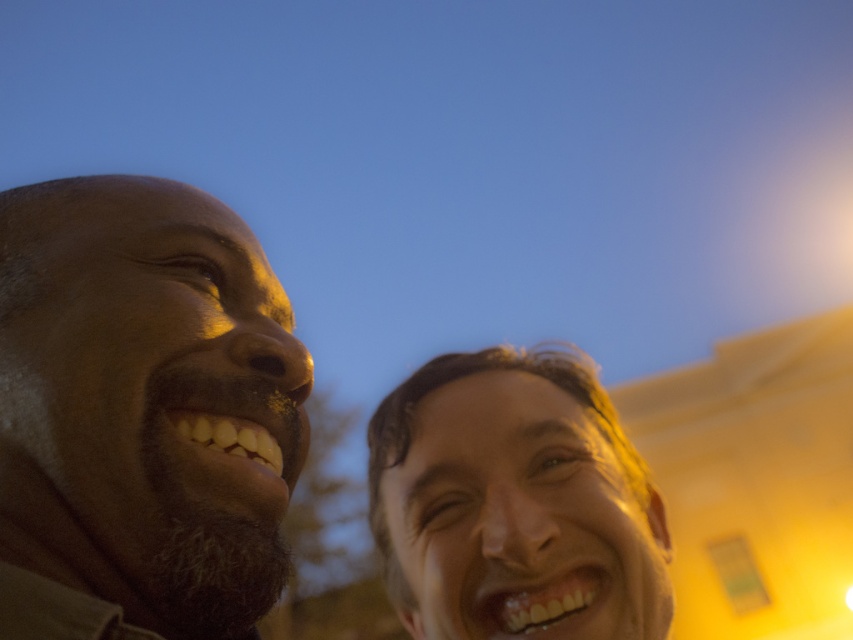
Question: Can you confirm if matte brown beard at left is positioned above shiny golden hair at center?

Choices:
 (A) no
 (B) yes

Answer: (B)

Question: Which of the following is the closest to the observer?

Choices:
 (A) click(x=1, y=540)
 (B) click(x=665, y=593)

Answer: (A)

Question: Is matte brown beard at left to the left of shiny golden hair at center from the viewer's perspective?

Choices:
 (A) yes
 (B) no

Answer: (A)

Question: Considering the relative positions of matte brown beard at left and shiny golden hair at center in the image provided, where is matte brown beard at left located with respect to shiny golden hair at center?

Choices:
 (A) right
 (B) left

Answer: (B)

Question: Which object is closer to the camera taking this photo?

Choices:
 (A) matte brown beard at left
 (B) shiny golden hair at center

Answer: (A)